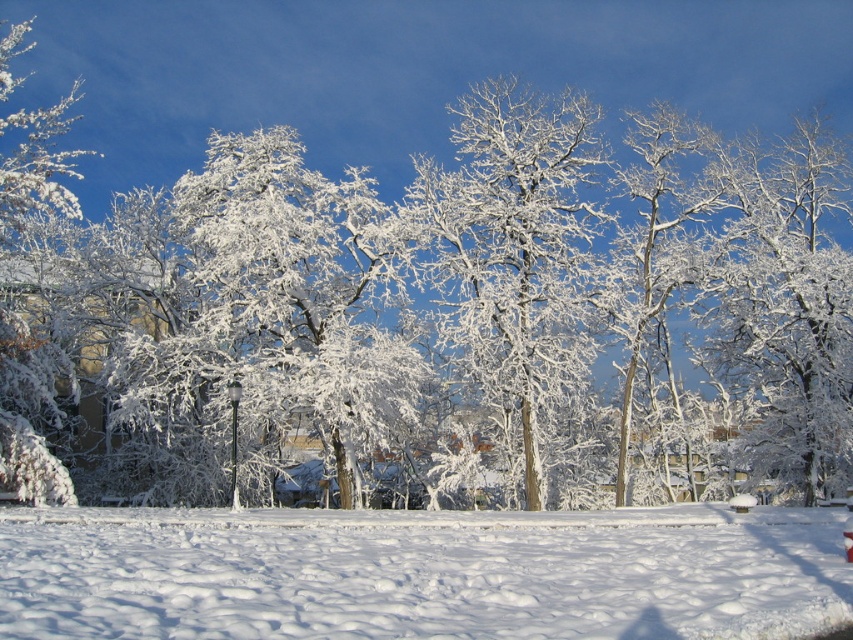
You are planning to place a small bench between the white frosty tree at center and the white frosty tree at upper right. The bench requires 7 meters of space. Is there enough space between them?

The distance between the white frosty tree at center and the white frosty tree at upper right is 6.99 meters, which is slightly less than the required 7 meters. Therefore, there isn not enough space to place the bench between them.

In the scene shown: You are standing in the winter scene and want to take a photo of both the white frosty tree at center and the white frosty tree at upper right. Which tree should you focus on first if you want to ensure both are in sharp focus?

You should focus on the white frosty tree at center first because it is closer to you than the white frosty tree at upper right. By focusing on the closer tree, the farther one will also be in focus due to the depth of field.